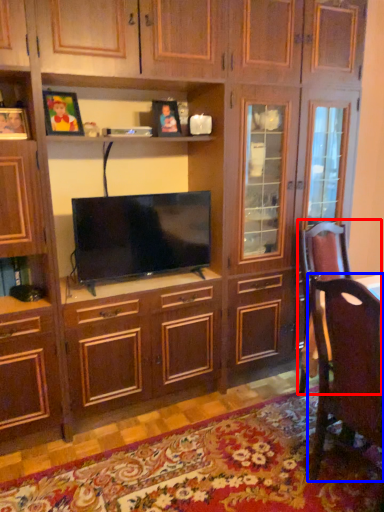
Question: Among these objects, which one is farthest to the camera, swivel chair (highlighted by a red box) or chair (highlighted by a blue box)?

Choices:
 (A) swivel chair
 (B) chair

Answer: (A)